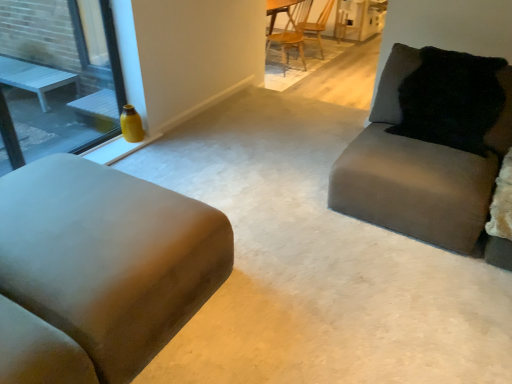
Question: Can you confirm if suede-like beige couch at left, the 2th studio couch positioned from the right, is bigger than black fuzzy pillow at upper right?

Choices:
 (A) no
 (B) yes

Answer: (B)

Question: Can you confirm if suede-like beige couch at left, the 2th studio couch positioned from the right, is wider than black fuzzy pillow at upper right?

Choices:
 (A) yes
 (B) no

Answer: (A)

Question: Is suede-like beige couch at left, the 1th studio couch from the left, to the left of black fuzzy pillow at upper right from the viewer's perspective?

Choices:
 (A) yes
 (B) no

Answer: (A)

Question: Is suede-like beige couch at left, the 2th studio couch positioned from the right, looking in the opposite direction of black fuzzy pillow at upper right?

Choices:
 (A) yes
 (B) no

Answer: (B)

Question: Considering the relative sizes of suede-like beige couch at left, the 2th studio couch positioned from the right, and black fuzzy pillow at upper right in the image provided, is suede-like beige couch at left, the 2th studio couch positioned from the right, thinner than black fuzzy pillow at upper right?

Choices:
 (A) yes
 (B) no

Answer: (B)

Question: Looking at their shapes, would you say matte yellow vase at left is wider or thinner than suede-like beige couch at left, the 2th studio couch positioned from the right?

Choices:
 (A) wide
 (B) thin

Answer: (B)

Question: Is matte yellow vase at left to the left or to the right of suede-like beige couch at left, the 2th studio couch positioned from the right, in the image?

Choices:
 (A) right
 (B) left

Answer: (B)

Question: In terms of height, does matte yellow vase at left look taller or shorter compared to suede-like beige couch at left, the 1th studio couch from the left?

Choices:
 (A) tall
 (B) short

Answer: (A)

Question: Looking at the image, does matte yellow vase at left seem bigger or smaller compared to suede-like beige couch at left, the 1th studio couch from the left?

Choices:
 (A) small
 (B) big

Answer: (A)

Question: From the image's perspective, is black fuzzy pillow at upper right above or below suede-like beige couch at left, the 2th studio couch positioned from the right?

Choices:
 (A) above
 (B) below

Answer: (A)

Question: From a real-world perspective, is black fuzzy pillow at upper right positioned above or below suede-like beige couch at left, the 2th studio couch positioned from the right?

Choices:
 (A) below
 (B) above

Answer: (B)

Question: Looking at their shapes, would you say black fuzzy pillow at upper right is wider or thinner than suede-like beige couch at left, the 1th studio couch from the left?

Choices:
 (A) wide
 (B) thin

Answer: (B)

Question: From their relative heights in the image, would you say black fuzzy pillow at upper right is taller or shorter than suede-like beige couch at left, the 1th studio couch from the left?

Choices:
 (A) tall
 (B) short

Answer: (A)

Question: In terms of size, does suede-like beige couch at left, the 2th studio couch positioned from the right, appear bigger or smaller than wooden chair at upper center, marked as the 2th chair in a back-to-front arrangement?

Choices:
 (A) small
 (B) big

Answer: (B)

Question: Would you say suede-like beige couch at left, the 2th studio couch positioned from the right, is to the left or to the right of wooden chair at upper center, the first chair when ordered from front to back, in the picture?

Choices:
 (A) left
 (B) right

Answer: (A)